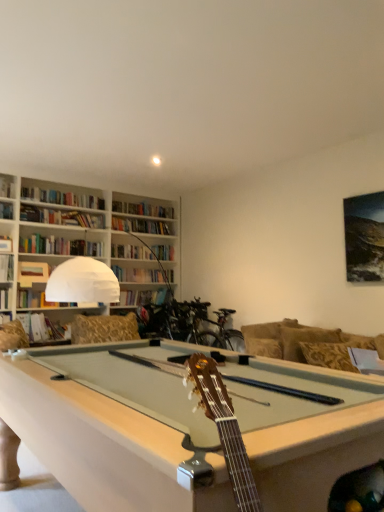
Measure the distance between point (380, 372) and camera.

Point (380, 372) is 8.16 feet away from camera.

What is the approximate width of gold-patterned fabric couch at right?

It is 22.62 inches.

What is the approximate height of matte brown book at upper left, placed as the 3th book when sorted from top to bottom?

matte brown book at upper left, placed as the 3th book when sorted from top to bottom, is 10.39 inches tall.

Measure the distance between hardcover book at left, positioned as the second book in top-to-bottom order, and camera.

They are 4.95 meters apart.

Describe the element at coordinates (43, 328) in the screenshot. This screenshot has width=384, height=512. I see `hardcover book at center-left, positioned as the fourth book in top-to-bottom order` at that location.

Locate an element on the screen. Image resolution: width=384 pixels, height=512 pixels. white fabric pillow at right is located at coordinates (366, 361).

From a real-world perspective, who is located lower, hardcover book at left, positioned as the second book in top-to-bottom order, or hardcover book at center-left, positioned as the fourth book in top-to-bottom order?

In real-world perspective, hardcover book at center-left, positioned as the fourth book in top-to-bottom order, is lower.

Is hardcover book at left, positioned as the second book in top-to-bottom order, not close to hardcover book at center-left, positioned as the fourth book in top-to-bottom order?

No, there isn't a large distance between hardcover book at left, positioned as the second book in top-to-bottom order, and hardcover book at center-left, positioned as the fourth book in top-to-bottom order.

Considering the sizes of hardcover book at center-left, arranged as the 1th book when ordered from the bottom, and hardcover book at left, the third book ordered from the bottom, in the image, is hardcover book at center-left, arranged as the 1th book when ordered from the bottom, wider or thinner than hardcover book at left, the third book ordered from the bottom,?

In the image, hardcover book at center-left, arranged as the 1th book when ordered from the bottom, appears to be wider than hardcover book at left, the third book ordered from the bottom.

Considering the sizes of hardcover book at center-left, positioned as the fourth book in top-to-bottom order, and hardcover book at left, the third book ordered from the bottom, in the image, is hardcover book at center-left, positioned as the fourth book in top-to-bottom order, taller or shorter than hardcover book at left, the third book ordered from the bottom,?

Considering their sizes, hardcover book at center-left, positioned as the fourth book in top-to-bottom order, has more height than hardcover book at left, the third book ordered from the bottom.

Where is `the 2nd book below when counting from the hardcover book at left, positioned as the second book in top-to-bottom order (from the image's perspective)`? the 2nd book below when counting from the hardcover book at left, positioned as the second book in top-to-bottom order (from the image's perspective) is located at coordinates (43, 328).

From the image's perspective, which one is positioned higher, hardcover book at center-left, positioned as the fourth book in top-to-bottom order, or hardcover book at left, the third book ordered from the bottom?

hardcover book at left, the third book ordered from the bottom.

From the image's perspective, which one is positioned lower, hardcover book at upper left, positioned as the fourth book in bottom-to-top order, or matte brown book at upper left, placed as the 3th book when sorted from top to bottom?

From the image's view, matte brown book at upper left, placed as the 3th book when sorted from top to bottom, is below.

How much distance is there between hardcover book at upper left, which ranks as the first book in top-to-bottom order, and matte brown book at upper left, placed as the 3th book when sorted from top to bottom?

94.97 centimeters.

Looking at this image, could you tell me if hardcover book at upper left, positioned as the fourth book in bottom-to-top order, is facing matte brown book at upper left, acting as the second book starting from the bottom?

No, hardcover book at upper left, positioned as the fourth book in bottom-to-top order, is not facing towards matte brown book at upper left, acting as the second book starting from the bottom.

In the scene shown: From a real-world perspective, is hardcover book at upper left, positioned as the fourth book in bottom-to-top order, on matte brown book at upper left, placed as the 3th book when sorted from top to bottom?

Indeed, from a real-world perspective, hardcover book at upper left, positioned as the fourth book in bottom-to-top order, stands above matte brown book at upper left, placed as the 3th book when sorted from top to bottom.

Is hardcover book at center-left, arranged as the 1th book when ordered from the bottom, turned away from gold-patterned fabric couch at right?

No, gold-patterned fabric couch at right is not at the back of hardcover book at center-left, arranged as the 1th book when ordered from the bottom.

From a real-world perspective, who is located higher, hardcover book at center-left, positioned as the fourth book in top-to-bottom order, or gold-patterned fabric couch at right?

gold-patterned fabric couch at right.

Looking at this image, from the image's perspective, who appears lower, hardcover book at center-left, positioned as the fourth book in top-to-bottom order, or gold-patterned fabric couch at right?

hardcover book at center-left, positioned as the fourth book in top-to-bottom order, appears lower in the image.

Considering the positions of objects hardcover book at center-left, arranged as the 1th book when ordered from the bottom, and matte brown book at upper left, acting as the second book starting from the bottom, in the image provided, who is more to the left, hardcover book at center-left, arranged as the 1th book when ordered from the bottom, or matte brown book at upper left, acting as the second book starting from the bottom,?

matte brown book at upper left, acting as the second book starting from the bottom.

Is hardcover book at center-left, arranged as the 1th book when ordered from the bottom, wider or thinner than matte brown book at upper left, acting as the second book starting from the bottom?

Considering their sizes, hardcover book at center-left, arranged as the 1th book when ordered from the bottom, looks broader than matte brown book at upper left, acting as the second book starting from the bottom.

Is hardcover book at center-left, positioned as the fourth book in top-to-bottom order, facing away from matte brown book at upper left, acting as the second book starting from the bottom?

That's not correct — hardcover book at center-left, positioned as the fourth book in top-to-bottom order, is not looking away from matte brown book at upper left, acting as the second book starting from the bottom.

In the scene shown: From the image's perspective, relative to matte brown book at upper left, placed as the 3th book when sorted from top to bottom, is hardcover book at center-left, arranged as the 1th book when ordered from the bottom, above or below?

Clearly, from the image's perspective, hardcover book at center-left, arranged as the 1th book when ordered from the bottom, is below matte brown book at upper left, placed as the 3th book when sorted from top to bottom.

From the image's perspective, relative to hardcover book at left, the third book ordered from the bottom, is gold-patterned fabric couch at right above or below?

gold-patterned fabric couch at right is situated lower than hardcover book at left, the third book ordered from the bottom, in the image.

Considering the relative positions of gold-patterned fabric couch at right and hardcover book at left, positioned as the second book in top-to-bottom order, in the image provided, is gold-patterned fabric couch at right to the left of hardcover book at left, positioned as the second book in top-to-bottom order, from the viewer's perspective?

In fact, gold-patterned fabric couch at right is to the right of hardcover book at left, positioned as the second book in top-to-bottom order.

Is gold-patterned fabric couch at right positioned far away from hardcover book at left, positioned as the second book in top-to-bottom order?

gold-patterned fabric couch at right is far away from hardcover book at left, positioned as the second book in top-to-bottom order.

Is gold-patterned fabric couch at right wider or thinner than hardcover book at left, the third book ordered from the bottom?

Considering their sizes, gold-patterned fabric couch at right looks broader than hardcover book at left, the third book ordered from the bottom.

Can you confirm if hardcover book at upper left, which ranks as the first book in top-to-bottom order, is wider than white fabric pillow at right?

Indeed, hardcover book at upper left, which ranks as the first book in top-to-bottom order, has a greater width compared to white fabric pillow at right.

From a real-world perspective, which is physically below, hardcover book at upper left, positioned as the fourth book in bottom-to-top order, or white fabric pillow at right?

In real-world perspective, white fabric pillow at right is lower.

Is there a large distance between hardcover book at upper left, which ranks as the first book in top-to-bottom order, and white fabric pillow at right?

Absolutely, hardcover book at upper left, which ranks as the first book in top-to-bottom order, is distant from white fabric pillow at right.

Identify the location of the 2nd book positioned above the hardcover book at center-left, positioned as the fourth book in top-to-bottom order (from the image's perspective). (6, 244).

Find the location of a particular element. book that is the 2nd object located below the hardcover book at left, the third book ordered from the bottom (from the image's perspective) is located at coordinates pyautogui.click(x=43, y=328).

Which object lies further to the anchor point hardcover book at left, positioned as the second book in top-to-bottom order, hardcover book at center-left, positioned as the fourth book in top-to-bottom order, or gold-patterned fabric couch at right?

Based on the image, gold-patterned fabric couch at right appears to be further to hardcover book at left, positioned as the second book in top-to-bottom order.

Which object lies further to the anchor point matte brown book at upper left, acting as the second book starting from the bottom, hardcover book at upper left, positioned as the fourth book in bottom-to-top order, or gold-patterned fabric couch at right?

The object further to matte brown book at upper left, acting as the second book starting from the bottom, is gold-patterned fabric couch at right.

Looking at the image, which one is located closer to hardcover book at center-left, positioned as the fourth book in top-to-bottom order, white fabric pillow at right or matte brown book at upper left, placed as the 3th book when sorted from top to bottom?

matte brown book at upper left, placed as the 3th book when sorted from top to bottom, lies closer to hardcover book at center-left, positioned as the fourth book in top-to-bottom order, than the other object.

When comparing their distances from gold-patterned fabric couch at right, does hardcover book at upper left, positioned as the fourth book in bottom-to-top order, or matte brown book at upper left, placed as the 3th book when sorted from top to bottom, seem further?

hardcover book at upper left, positioned as the fourth book in bottom-to-top order, is further to gold-patterned fabric couch at right.

Based on their spatial positions, is hardcover book at center-left, positioned as the fourth book in top-to-bottom order, or matte brown book at upper left, placed as the 3th book when sorted from top to bottom, closer to gold-patterned fabric couch at right?

Based on the image, hardcover book at center-left, positioned as the fourth book in top-to-bottom order, appears to be nearer to gold-patterned fabric couch at right.

Looking at the image, which one is located closer to gold-patterned fabric couch at right, matte brown book at upper left, acting as the second book starting from the bottom, or hardcover book at upper left, positioned as the fourth book in bottom-to-top order?

matte brown book at upper left, acting as the second book starting from the bottom, lies closer to gold-patterned fabric couch at right than the other object.

Considering their positions, is hardcover book at center-left, arranged as the 1th book when ordered from the bottom, positioned further to gold-patterned fabric couch at right than hardcover book at upper left, positioned as the fourth book in bottom-to-top order?

hardcover book at upper left, positioned as the fourth book in bottom-to-top order, lies further to gold-patterned fabric couch at right than the other object.

When comparing their distances from hardcover book at left, the third book ordered from the bottom, does hardcover book at upper left, positioned as the fourth book in bottom-to-top order, or hardcover book at center-left, arranged as the 1th book when ordered from the bottom, seem closer?

hardcover book at upper left, positioned as the fourth book in bottom-to-top order.

Locate an element on the screen. Image resolution: width=384 pixels, height=512 pixels. couch between matte brown book at upper left, acting as the second book starting from the bottom, and white fabric pillow at right from left to right is located at coordinates tap(312, 345).

You are a GUI agent. You are given a task and a screenshot of the screen. Output one action in this format:
    pyautogui.click(x=<x>, y=<y>)
    Task: Click on the couch between hardcover book at center-left, positioned as the fourth book in top-to-bottom order, and white fabric pillow at right, in the horizontal direction
    The height and width of the screenshot is (512, 384).
    Given the screenshot: What is the action you would take?
    pyautogui.click(x=312, y=345)

Find the location of a particular element. book between hardcover book at left, positioned as the second book in top-to-bottom order, and hardcover book at center-left, arranged as the 1th book when ordered from the bottom, in the up-down direction is located at coordinates (32, 273).

At what (x,y) coordinates should I click in order to perform the action: click on couch between hardcover book at upper left, which ranks as the first book in top-to-bottom order, and white fabric pillow at right. Please return your answer as a coordinate pair (x, y). Looking at the image, I should click on (312, 345).